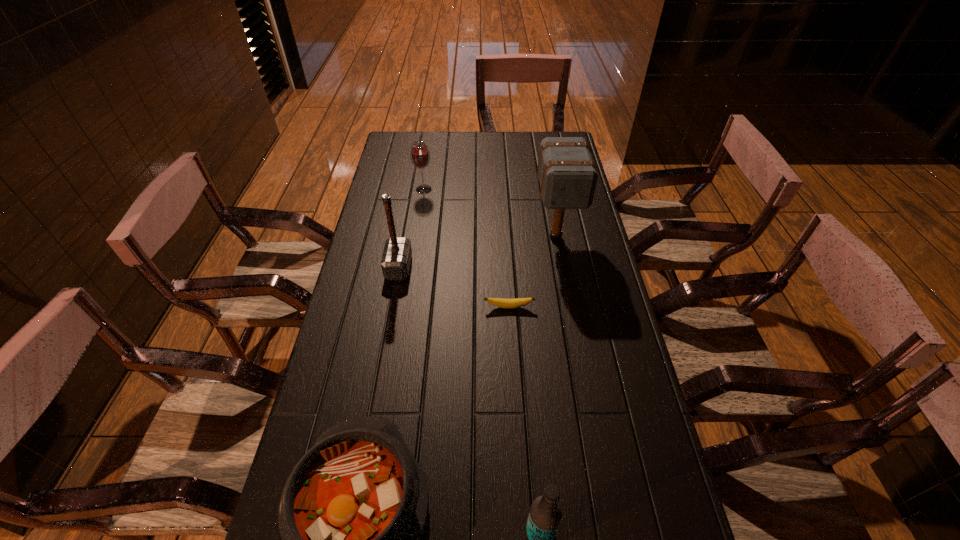
The width and height of the screenshot is (960, 540). In order to click on vacant region located 0.170m on the front of the fourth farthest object in this screenshot , I will do `click(512, 360)`.

The image size is (960, 540). I want to click on hammer that is positioned at the left edge, so click(x=396, y=259).

The width and height of the screenshot is (960, 540). What are the coordinates of `wineglass situated at the left edge` in the screenshot? It's located at (420, 157).

At what (x,y) coordinates should I click in order to perform the action: click on object situated at the right edge. Please return your answer as a coordinate pair (x, y). The image size is (960, 540). Looking at the image, I should click on (568, 176).

Locate an element on the screen. Image resolution: width=960 pixels, height=540 pixels. vacant position at the far edge of the desktop is located at coordinates (532, 150).

You are a GUI agent. You are given a task and a screenshot of the screen. Output one action in this format:
    pyautogui.click(x=<x>, y=<y>)
    Task: Click on the vacant space at the left edge of the desktop
    The image size is (960, 540).
    Given the screenshot: What is the action you would take?
    pyautogui.click(x=386, y=162)

Image resolution: width=960 pixels, height=540 pixels. Find the location of `free location at the right edge of the desktop`. free location at the right edge of the desktop is located at coordinates (595, 226).

You are a GUI agent. You are given a task and a screenshot of the screen. Output one action in this format:
    pyautogui.click(x=<x>, y=<y>)
    Task: Click on the unoccupied position between the wineglass and the mallet
    The height and width of the screenshot is (540, 960).
    Given the screenshot: What is the action you would take?
    pyautogui.click(x=490, y=213)

Image resolution: width=960 pixels, height=540 pixels. I want to click on vacant space that is in between the rightmost object and the wineglass, so click(490, 213).

Locate an element on the screen. vacant area that lies between the farthest object and the third nearest object is located at coordinates (467, 248).